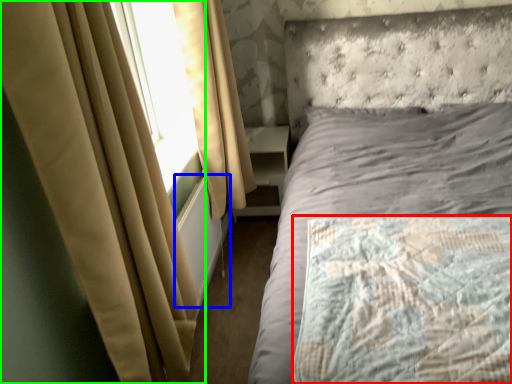
Question: Which object is positioned farthest from mattress (highlighted by a red box)? Select from radiator (highlighted by a blue box) and curtain (highlighted by a green box).

Choices:
 (A) radiator
 (B) curtain

Answer: (A)